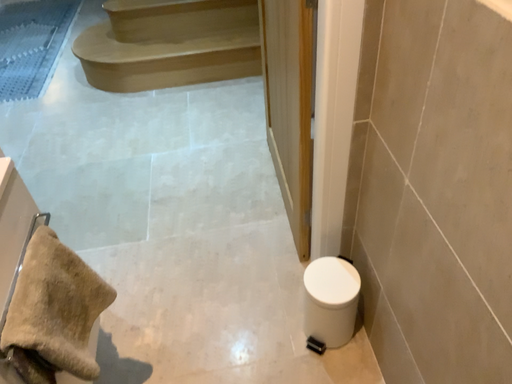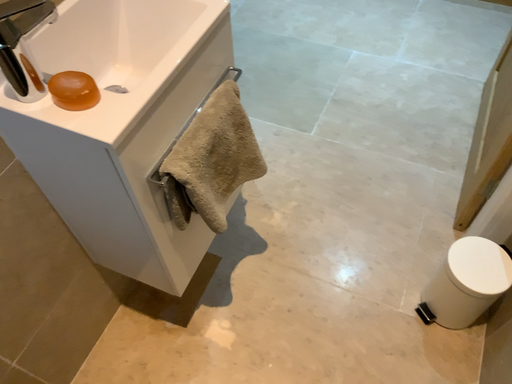
Question: How did the camera likely rotate when shooting the video?

Choices:
 (A) rotated left
 (B) rotated right

Answer: (A)